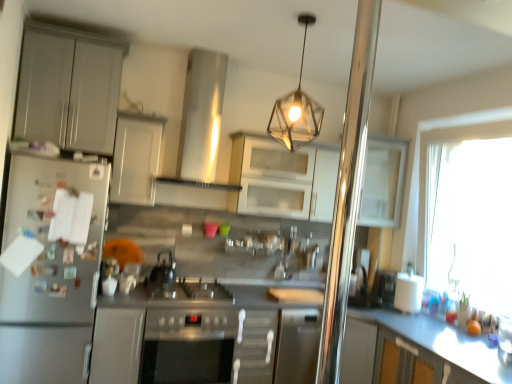
Question: Can you confirm if metallic hexagonal light fixture at upper center is bigger than white glossy cabinet at upper right, the fifth cabinetry in the left-to-right sequence?

Choices:
 (A) yes
 (B) no

Answer: (B)

Question: Is metallic hexagonal light fixture at upper center further to the viewer compared to white glossy cabinet at upper right, arranged as the 1th cabinetry when viewed from the right?

Choices:
 (A) yes
 (B) no

Answer: (B)

Question: Is white glossy cabinet at upper right, the fifth cabinetry in the left-to-right sequence, at the back of metallic hexagonal light fixture at upper center?

Choices:
 (A) yes
 (B) no

Answer: (B)

Question: Is metallic hexagonal light fixture at upper center at the left side of white glossy cabinet at upper right, the fifth cabinetry in the left-to-right sequence?

Choices:
 (A) yes
 (B) no

Answer: (A)

Question: From the image's perspective, does metallic hexagonal light fixture at upper center appear higher than white glossy cabinet at upper right, the fifth cabinetry in the left-to-right sequence?

Choices:
 (A) no
 (B) yes

Answer: (B)

Question: Based on their sizes in the image, would you say satin silver exhaust hood at upper center is bigger or smaller than stainless steel oven at center?

Choices:
 (A) big
 (B) small

Answer: (B)

Question: Would you say satin silver exhaust hood at upper center is inside or outside stainless steel oven at center?

Choices:
 (A) inside
 (B) outside

Answer: (B)

Question: From their relative heights in the image, would you say satin silver exhaust hood at upper center is taller or shorter than stainless steel oven at center?

Choices:
 (A) short
 (B) tall

Answer: (B)

Question: From the image's perspective, is satin silver exhaust hood at upper center located above or below stainless steel oven at center?

Choices:
 (A) above
 (B) below

Answer: (A)

Question: Would you say white matte cabinet at upper center, which is the 3th cabinetry from left to right, is to the left or to the right of white glossy countertop at lower right in the picture?

Choices:
 (A) left
 (B) right

Answer: (A)

Question: Is white matte cabinet at upper center, arranged as the third cabinetry when viewed from the right, wider or thinner than white glossy countertop at lower right?

Choices:
 (A) thin
 (B) wide

Answer: (A)

Question: Based on their sizes in the image, would you say white matte cabinet at upper center, which is the 3th cabinetry from left to right, is bigger or smaller than white glossy countertop at lower right?

Choices:
 (A) small
 (B) big

Answer: (A)

Question: Is point (138, 196) closer or farther from the camera than point (407, 370)?

Choices:
 (A) closer
 (B) farther

Answer: (B)

Question: Would you say satin silver refrigerator at left is to the left or to the right of shiny metallic kettle at center in the picture?

Choices:
 (A) right
 (B) left

Answer: (B)

Question: Relative to shiny metallic kettle at center, is satin silver refrigerator at left in front or behind?

Choices:
 (A) front
 (B) behind

Answer: (A)